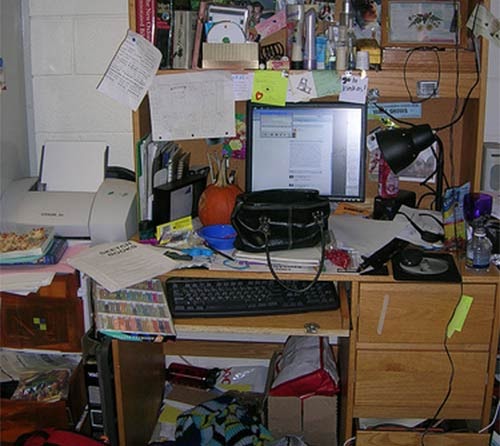
Identify the location of keyboard shelf. Image resolution: width=500 pixels, height=446 pixels. (284, 323).